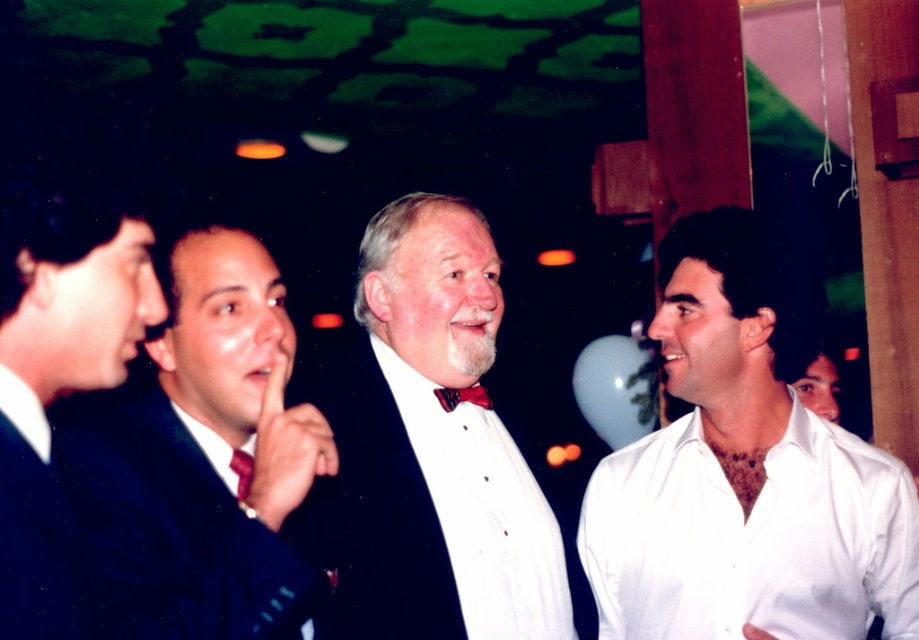
Is point (783, 468) positioned before point (401, 385)?

No, it is not.

Consider the image. Does white cotton shirt at right have a lesser width compared to matte black suit at center?

No.

The width and height of the screenshot is (919, 640). In order to click on white cotton shirt at right in this screenshot , I will do `click(745, 468)`.

Is shiny dark suit at center further to camera compared to shiny red tie at center?

No, shiny dark suit at center is closer to the viewer.

The width and height of the screenshot is (919, 640). What are the coordinates of `shiny dark suit at center` in the screenshot? It's located at (201, 460).

Does point (174, 348) lie behind point (248, 460)?

No, it is not.

I want to click on shiny dark suit at center, so click(201, 460).

Who is taller, matte black suit at center or red satin bow tie at center?

matte black suit at center

Does matte black suit at center appear under red satin bow tie at center?

Yes, matte black suit at center is below red satin bow tie at center.

Measure the distance between matte black suit at center and camera.

4.27 feet

Locate an element on the screen. matte black suit at center is located at coordinates (430, 449).